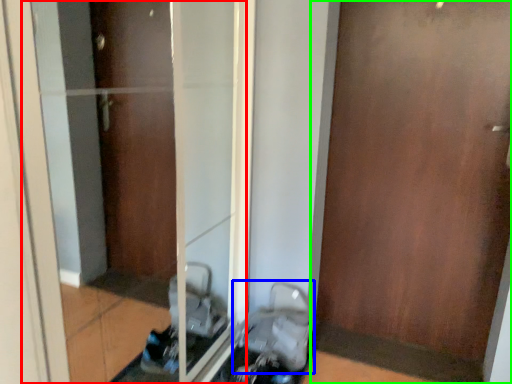
Question: Based on their relative distances, which object is nearer to glass door (highlighted by a red box)? Choose from baby carriage (highlighted by a blue box) and door (highlighted by a green box).

Choices:
 (A) baby carriage
 (B) door

Answer: (A)